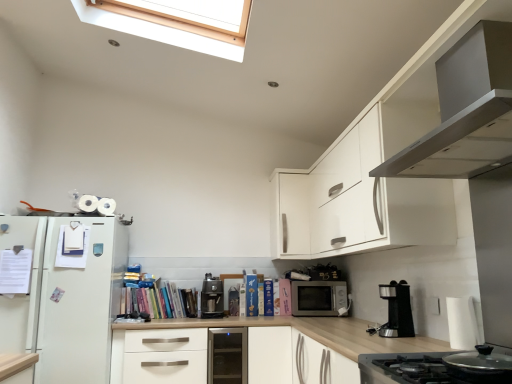
Question: Considering the relative sizes of white matte drawer at center and satin silver range hood at upper right, which is the second home appliance from bottom to top, in the image provided, is white matte drawer at center taller than satin silver range hood at upper right, which is the second home appliance from bottom to top,?

Choices:
 (A) no
 (B) yes

Answer: (B)

Question: Does white matte drawer at center turn towards satin silver range hood at upper right, which is the second home appliance from bottom to top?

Choices:
 (A) no
 (B) yes

Answer: (A)

Question: Is white matte drawer at center far from satin silver range hood at upper right, which is the second home appliance from bottom to top?

Choices:
 (A) no
 (B) yes

Answer: (B)

Question: Can you confirm if white matte drawer at center is positioned to the left of satin silver range hood at upper right, which is the 1th home appliance from top to bottom?

Choices:
 (A) yes
 (B) no

Answer: (A)

Question: Is white matte drawer at center outside of satin silver range hood at upper right, which is the 1th home appliance from top to bottom?

Choices:
 (A) yes
 (B) no

Answer: (A)

Question: Considering the relative sizes of white matte drawer at center and satin silver range hood at upper right, which is the second home appliance from bottom to top, in the image provided, is white matte drawer at center thinner than satin silver range hood at upper right, which is the second home appliance from bottom to top,?

Choices:
 (A) no
 (B) yes

Answer: (A)

Question: Is black plastic coffee machine at lower right, the 1th coffee machine in the right-to-left sequence, a part of matte silver microwave at center?

Choices:
 (A) no
 (B) yes

Answer: (A)

Question: Can you confirm if matte silver microwave at center is thinner than black plastic coffee machine at lower right, arranged as the 2th coffee machine when viewed from the left?

Choices:
 (A) no
 (B) yes

Answer: (A)

Question: Does matte silver microwave at center turn towards black plastic coffee machine at lower right, which is the 2th coffee machine in back-to-front order?

Choices:
 (A) yes
 (B) no

Answer: (A)

Question: Is matte silver microwave at center behind black plastic coffee machine at lower right, which is the 2th coffee machine in back-to-front order?

Choices:
 (A) yes
 (B) no

Answer: (A)

Question: Is matte silver microwave at center at the left side of black plastic coffee machine at lower right, positioned as the first coffee machine in front-to-back order?

Choices:
 (A) no
 (B) yes

Answer: (B)

Question: From the image's perspective, is matte silver microwave at center below black plastic coffee machine at lower right, positioned as the first coffee machine in front-to-back order?

Choices:
 (A) no
 (B) yes

Answer: (B)

Question: Considering the relative positions of satin silver dishwasher at center and stainless steel stove at lower right, marked as the second home appliance in a top-to-bottom arrangement, in the image provided, is satin silver dishwasher at center in front of stainless steel stove at lower right, marked as the second home appliance in a top-to-bottom arrangement,?

Choices:
 (A) yes
 (B) no

Answer: (B)